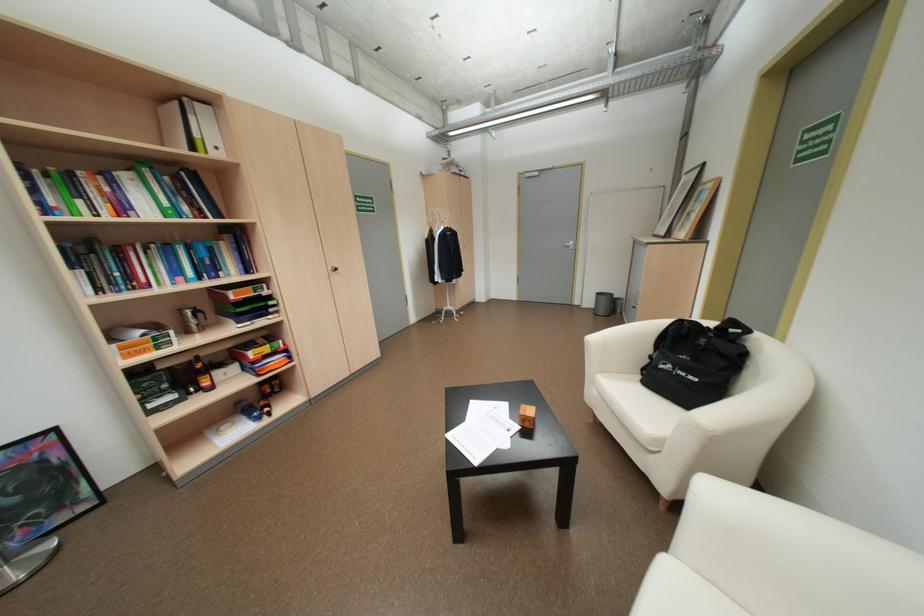
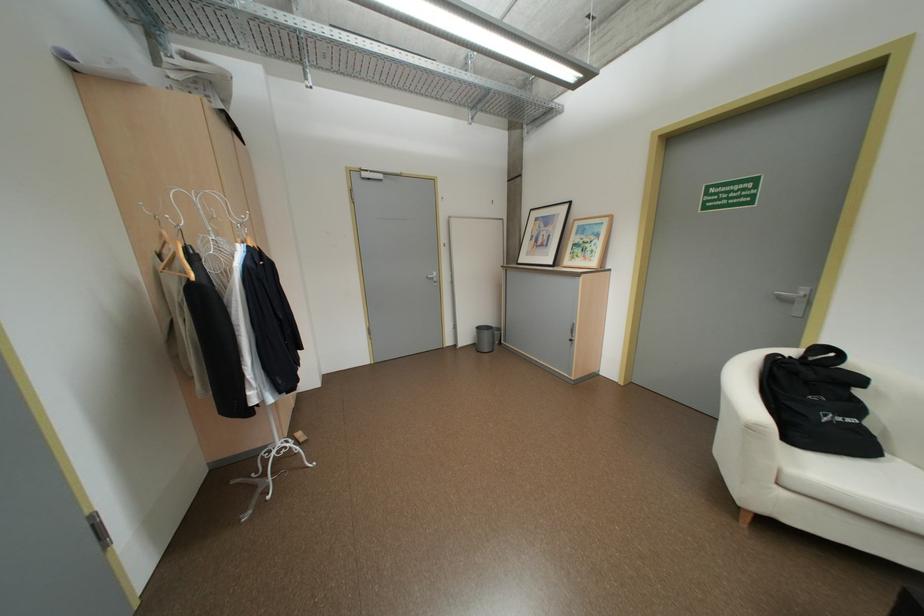
In the second image, find the point that corresponds to pixel 674 233 in the first image.

(561, 262)